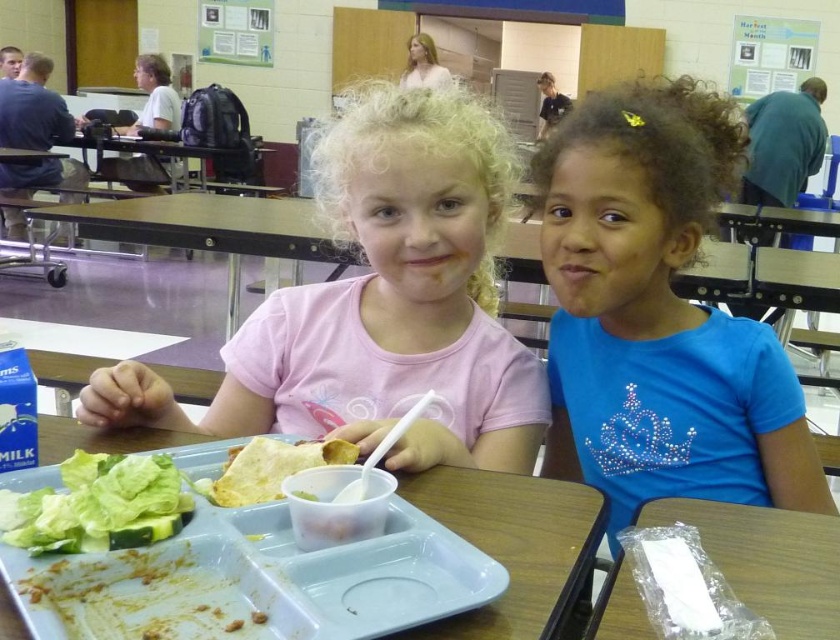
Based on the scene description, which object is taller between the matte pink shirt at center and the green leafy lettuce at lower left?

The matte pink shirt at center is taller than the green leafy lettuce at lower left.

In the school cafeteria scene, there is a white plastic tray at center and a yellowish tortilla at center. Which object is positioned to the right side?

The white plastic tray at center is to the right of the yellowish tortilla at center.